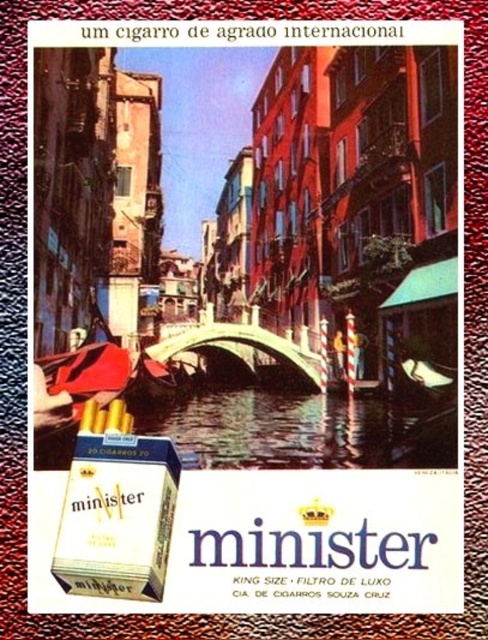
Does clear water at center have a lesser height compared to white matte cigarette box at lower left?

Correct, clear water at center is not as tall as white matte cigarette box at lower left.

Who is lower down, clear water at center or white matte cigarette box at lower left?

A: white matte cigarette box at lower left is below.

Locate an element on the screen. Image resolution: width=488 pixels, height=640 pixels. clear water at center is located at coordinates (304, 429).